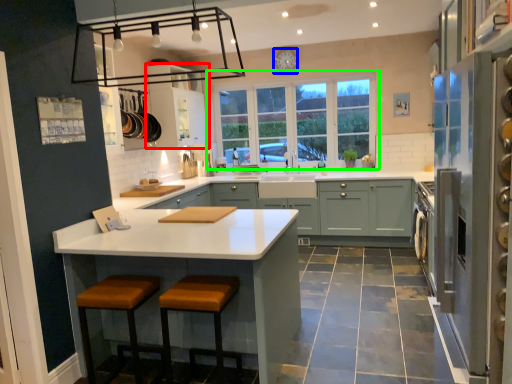
Question: Which object is the farthest from cabinetry (highlighted by a red box)? Choose among these: clock (highlighted by a blue box) or window (highlighted by a green box).

Choices:
 (A) clock
 (B) window

Answer: (A)